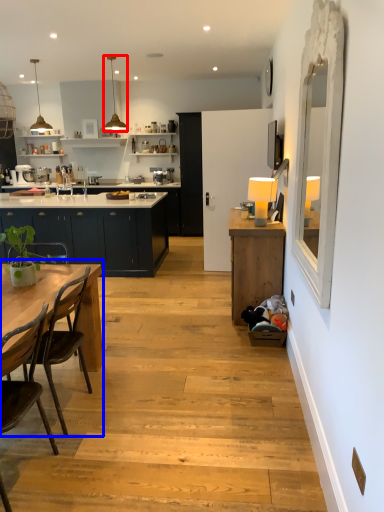
Question: Which point is further to the camera, lamp (highlighted by a red box) or kitchen & dining room table (highlighted by a blue box)?

Choices:
 (A) lamp
 (B) kitchen & dining room table

Answer: (A)